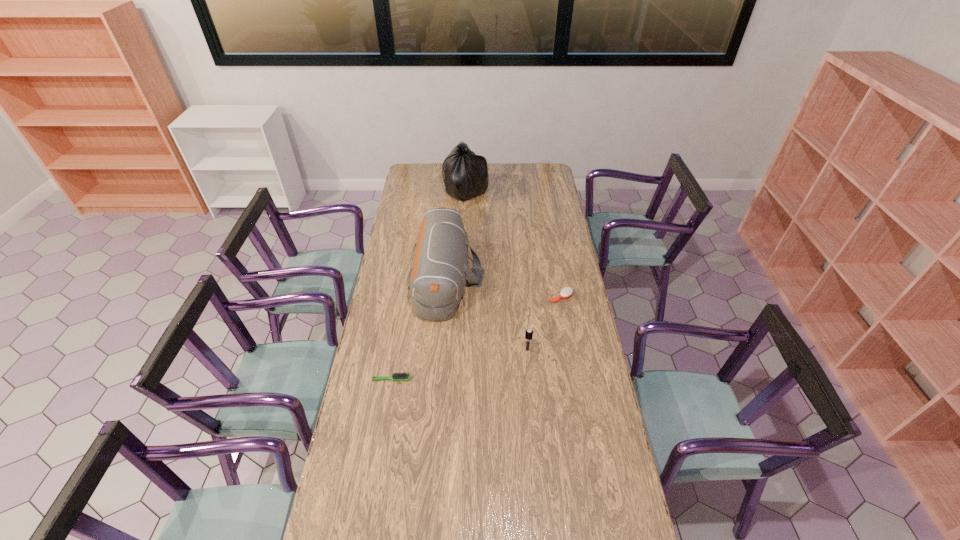
Where is `vacant region between the shortest hairbrush and the rightmost hairbrush`? The height and width of the screenshot is (540, 960). vacant region between the shortest hairbrush and the rightmost hairbrush is located at coordinates (476, 338).

Identify the location of vacant space in between the fourth farthest object and the farthest object. (496, 270).

The height and width of the screenshot is (540, 960). In order to click on object that is the third closest to the shortest object in this screenshot , I will do `click(566, 292)`.

Identify the location of the fourth closest object to the second nearest hairbrush. The image size is (960, 540). (465, 174).

Image resolution: width=960 pixels, height=540 pixels. In order to click on hairbrush that stands as the closest to the tallest object in this screenshot , I will do `click(566, 292)`.

What are the coordinates of `hairbrush that stands as the second closest to the shortest hairbrush` in the screenshot? It's located at (566, 292).

Where is `blank space that satisfies the following two spatial constraints: 1. on the front side of the tallest object; 2. on the right side of the second nearest object`? The image size is (960, 540). blank space that satisfies the following two spatial constraints: 1. on the front side of the tallest object; 2. on the right side of the second nearest object is located at coordinates (459, 350).

What are the coordinates of `free space that satisfies the following two spatial constraints: 1. on the back side of the second hairbrush from right to left; 2. on the left side of the shortest object` in the screenshot? It's located at (396, 350).